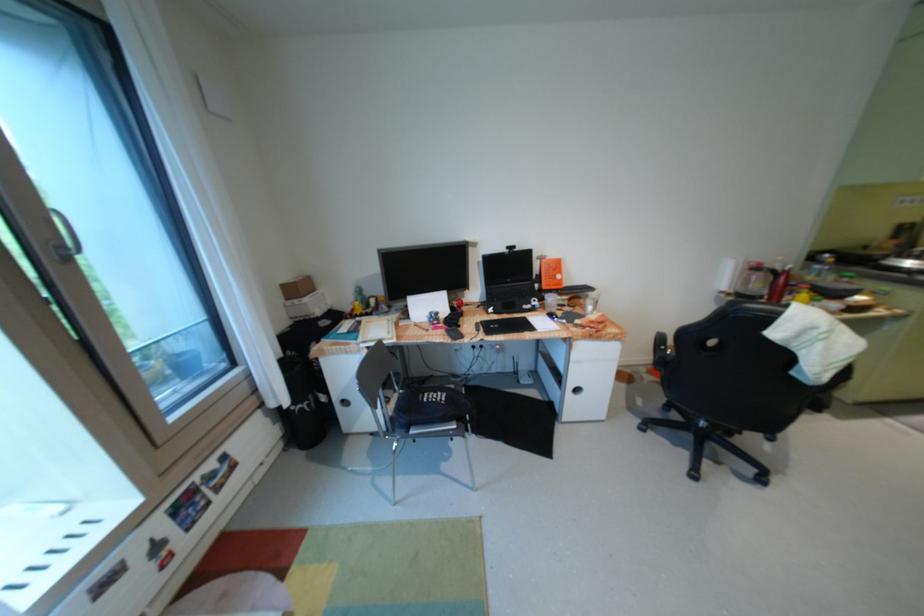
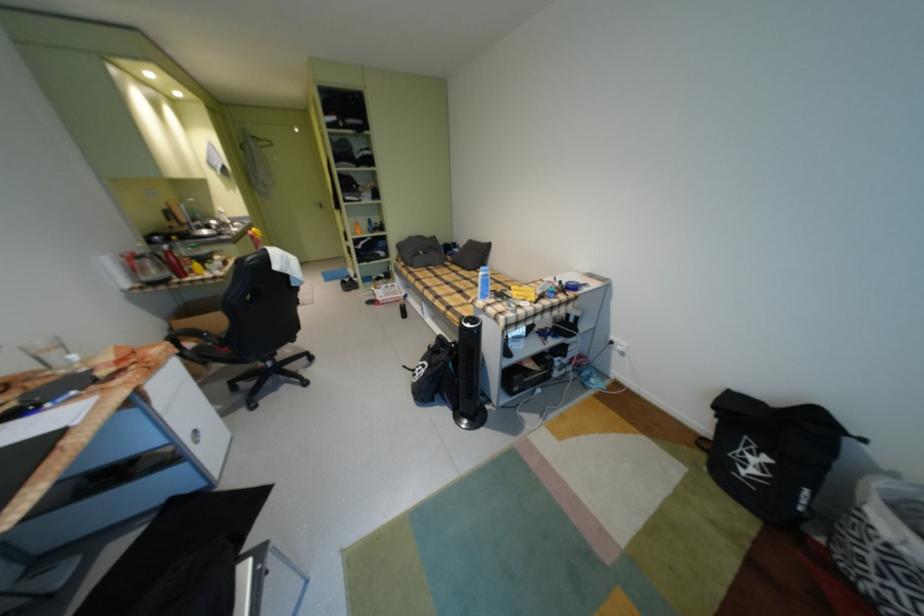
Locate, in the second image, the point that corresponds to (776,299) in the first image.

(185, 277)